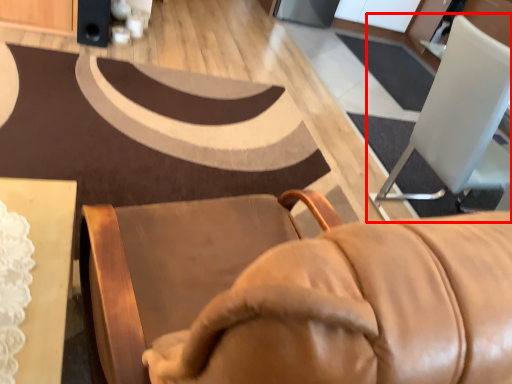
Question: From the image's perspective, considering the relative positions of chair (annotated by the red box) and speaker in the image provided, where is chair (annotated by the red box) located with respect to the staircase?

Choices:
 (A) below
 (B) above

Answer: (A)